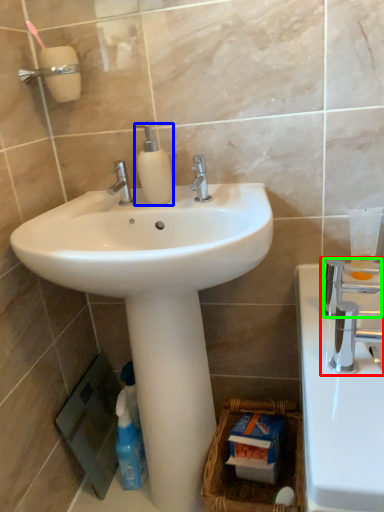
Question: Which object is positioned closest to tap (highlighted by a red box)? Select from soap dispenser (highlighted by a blue box) and plumbing fixture (highlighted by a green box).

Choices:
 (A) soap dispenser
 (B) plumbing fixture

Answer: (B)